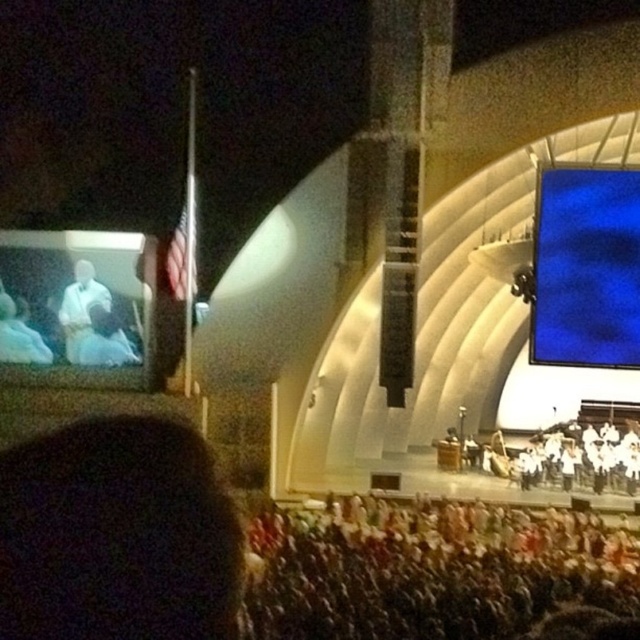
Question: Does dark hair at lower left have a larger size compared to white fabric crowd at lower center?

Choices:
 (A) yes
 (B) no

Answer: (B)

Question: Can you confirm if dark hair at lower left is positioned to the left of white fabric crowd at lower center?

Choices:
 (A) yes
 (B) no

Answer: (A)

Question: Which of the following is the closest to the observer?

Choices:
 (A) (19, 326)
 (B) (74, 275)
 (C) (625, 300)

Answer: (C)

Question: Is dark hair at lower left smaller than blue fabric screen at upper right?

Choices:
 (A) no
 (B) yes

Answer: (A)

Question: Which point is farther from the camera taking this photo?

Choices:
 (A) (33, 445)
 (B) (90, 288)

Answer: (B)

Question: Which point is closer to the camera?

Choices:
 (A) (625, 368)
 (B) (157, 564)
 (C) (74, 269)

Answer: (B)